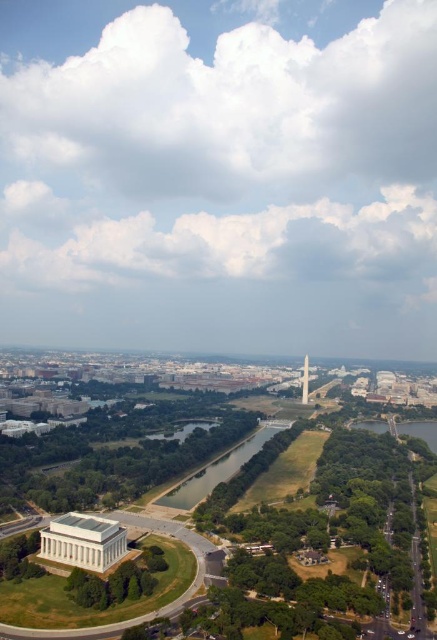
You are a city planner reviewing the layout of this historical site. You need to determine if the green grassy field at center can be used for a temporary event. Considering the white marble obelisk at center is a protected monument, is the field accessible for setup without affecting the obelisk?

The green grassy field at center is positioned under the white marble obelisk at center, which means the obelisk is directly above the field. This placement suggests the field is beneath the monument, making it inaccessible for setup without disturbing the protected structure.

You are a city planner reviewing the aerial view of the urban landscape. You need to determine if the green grassy field at center can accommodate a new statue that is as wide as the white marble obelisk at center. Based on the spatial information provided, what is your conclusion?

The green grassy field at center has a larger width than the white marble obelisk at center, so the statue can be placed there since the field is wider than the obelisk.

You are a city planner reviewing this urban layout. You need to determine which object between the green grassy field at center and the white marble obelisk at center is taller. Based on the aerial view provided, which one has a greater height?

The white marble obelisk at center is taller than the green grassy field at center.